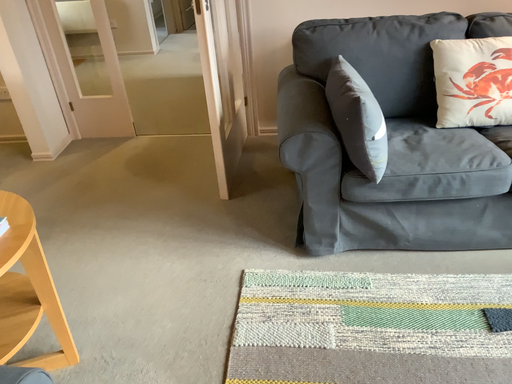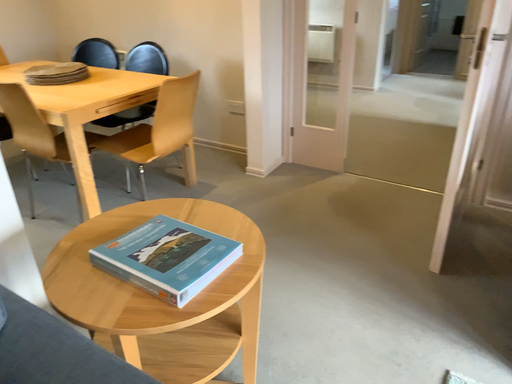
Question: Which way did the camera rotate in the video?

Choices:
 (A) rotated left
 (B) rotated right

Answer: (A)